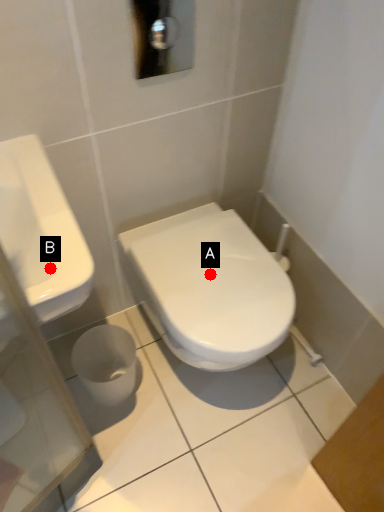
Question: Two points are circled on the image, labeled by A and B beside each circle. Which point is farther to the camera?

Choices:
 (A) A is further
 (B) B is further

Answer: (A)